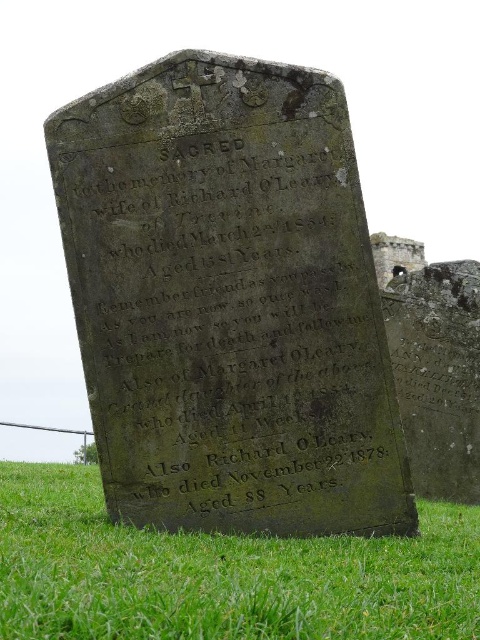
Based on the scene described, can you determine which object is larger between the weathered stone monument at center and the black stone gravestone at lower center?

The black stone gravestone at lower center is larger than the weathered stone monument at center.

Based on the scene description, where exactly is the weathered stone monument at center located in the image?

The weathered stone monument at center is located at point coordinates of (228, 301).